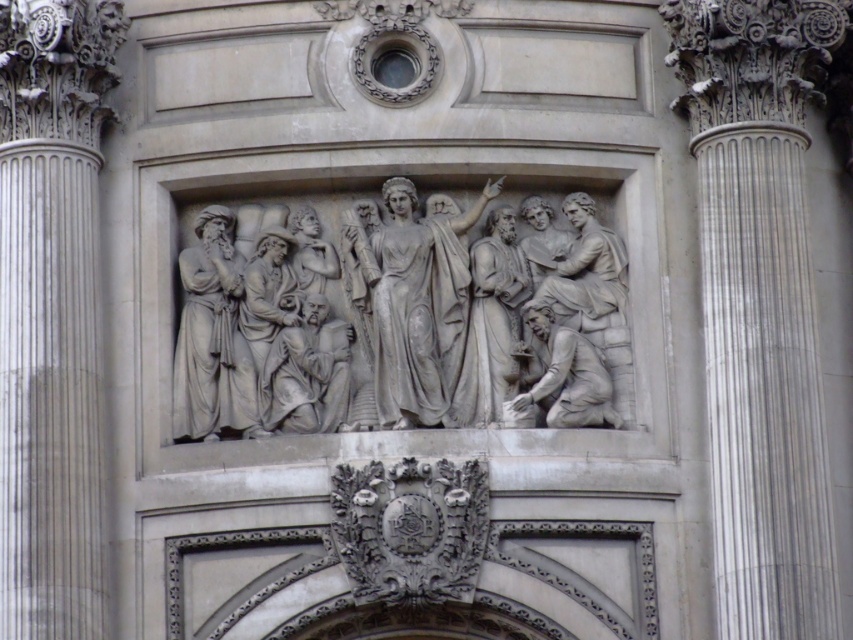
You are an architect examining the building facade and need to place a new decorative element. The white marble column at left is located at coordinates 0.494, 0.062. Where should you place your new element to ensure it aligns with the existing column?

The white marble column at left is located at coordinates (51, 316), so you should place your new element at the same coordinates to align with it.

You are an architect standing 250 feet away from the white marble column at left. Can you comfortably see the details of the relief sculpture on the column from your current position?

The white marble column at left is 255.32 feet away from the viewer. Since you are standing 250 feet away, you are closer than the column, but the distance is still quite large. It might be difficult to see the intricate details of the relief sculpture clearly without assistance like binoculars or a zoom lens.